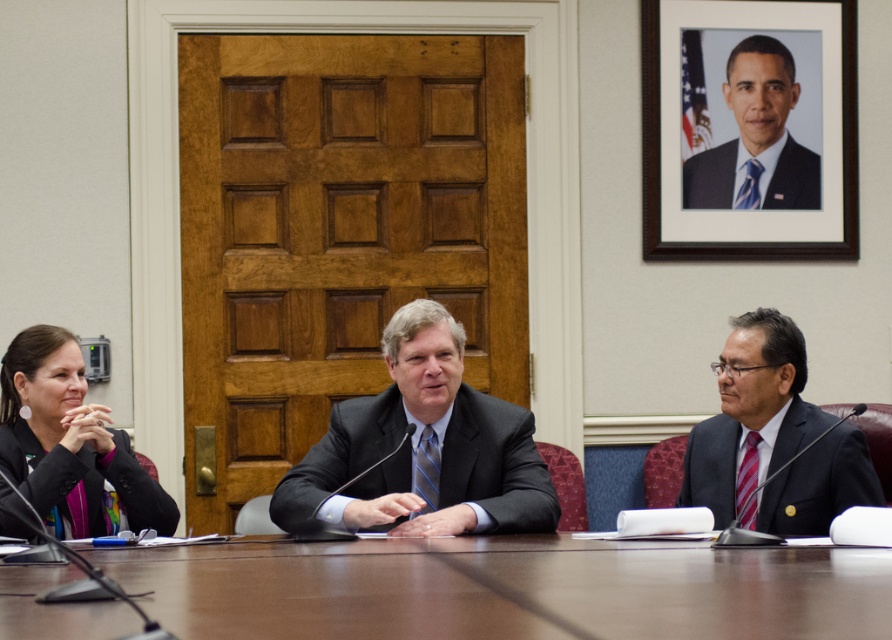
Which is in front, point (833, 467) or point (758, 70)?

Positioned in front is point (833, 467).

Can you confirm if matte black suit at right is positioned to the right of blue tie at upper right?

In fact, matte black suit at right is to the left of blue tie at upper right.

Describe the element at coordinates (750, 413) in the screenshot. The height and width of the screenshot is (640, 892). I see `matte black suit at right` at that location.

Locate an element on the screen. The width and height of the screenshot is (892, 640). matte black suit at right is located at coordinates (750, 413).

Between black matte picture frame at upper right and matte black jacket at left, which one appears on the left side from the viewer's perspective?

matte black jacket at left is more to the left.

Is black matte picture frame at upper right to the left of matte black jacket at left from the viewer's perspective?

In fact, black matte picture frame at upper right is to the right of matte black jacket at left.

Image resolution: width=892 pixels, height=640 pixels. What are the coordinates of `black matte picture frame at upper right` in the screenshot? It's located at (749, 129).

Is black matte picture frame at upper right taller than matte black suit at right?

Yes, black matte picture frame at upper right is taller than matte black suit at right.

Which of these two, black matte picture frame at upper right or matte black suit at right, stands taller?

black matte picture frame at upper right is taller.

Is point (720, 129) positioned after point (774, 460)?

Yes, point (720, 129) is behind point (774, 460).

This screenshot has width=892, height=640. In order to click on black matte picture frame at upper right in this screenshot , I will do `click(749, 129)`.